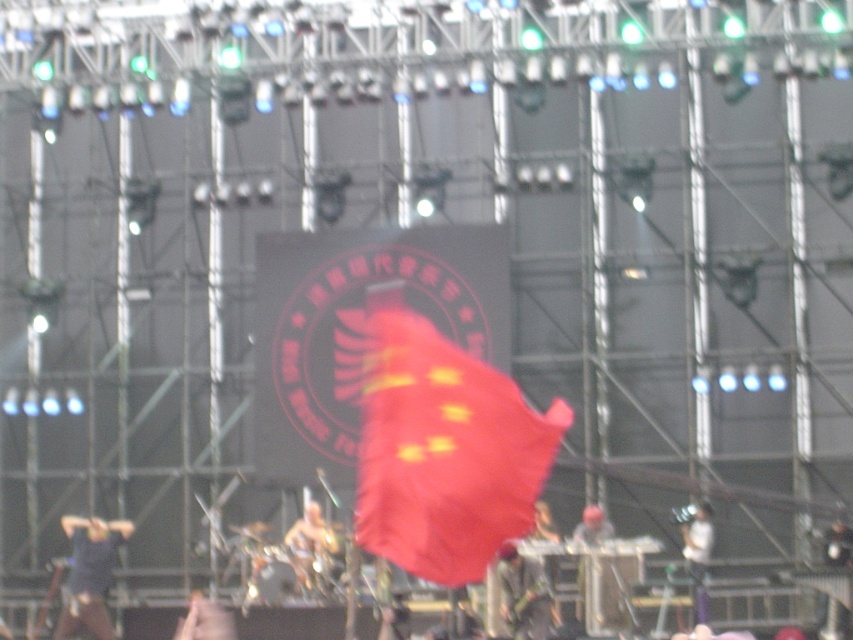
Question: Can you confirm if dark gray fabric at lower center is bigger than metallic gold helmet at center?

Choices:
 (A) no
 (B) yes

Answer: (A)

Question: Can you confirm if matte red flag at center is bigger than dark gray fabric at lower center?

Choices:
 (A) yes
 (B) no

Answer: (A)

Question: Which of the following is the closest to the observer?

Choices:
 (A) dark blue fabric at lower left
 (B) matte red flag at center

Answer: (B)

Question: Which point is farther to the camera?

Choices:
 (A) (517, 577)
 (B) (318, 576)
 (C) (416, 433)

Answer: (B)

Question: Observing the image, what is the correct spatial positioning of matte red flag at center in reference to dark blue fabric at lower left?

Choices:
 (A) left
 (B) right

Answer: (B)

Question: Which point is closer to the camera?

Choices:
 (A) (299, 576)
 (B) (582, 525)

Answer: (A)